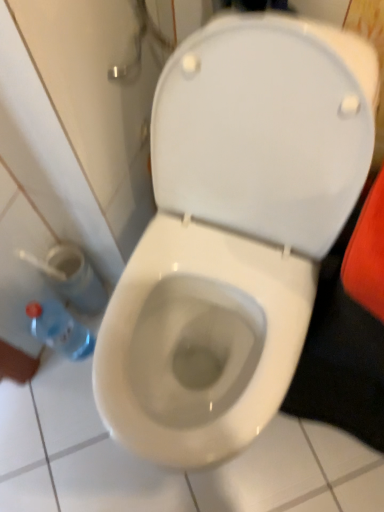
Question: From a real-world perspective, is blue plastic bottle at lower left located higher than white glossy toilet at center?

Choices:
 (A) no
 (B) yes

Answer: (A)

Question: Is blue plastic bottle at lower left oriented away from white glossy toilet at center?

Choices:
 (A) no
 (B) yes

Answer: (A)

Question: Can you confirm if blue plastic bottle at lower left is wider than white glossy toilet at center?

Choices:
 (A) no
 (B) yes

Answer: (A)

Question: Does blue plastic bottle at lower left appear on the right side of white glossy toilet at center?

Choices:
 (A) yes
 (B) no

Answer: (B)

Question: Is blue plastic bottle at lower left in front of white glossy toilet at center?

Choices:
 (A) no
 (B) yes

Answer: (A)

Question: Is blue plastic bottle at lower left outside of white glossy toilet at center?

Choices:
 (A) yes
 (B) no

Answer: (A)

Question: Is blue plastic bottle at lower left surrounded by white glossy toilet at center?

Choices:
 (A) no
 (B) yes

Answer: (A)

Question: From a real-world perspective, is white glossy toilet at center under blue plastic bottle at lower left?

Choices:
 (A) no
 (B) yes

Answer: (A)

Question: From a real-world perspective, does white glossy toilet at center stand above blue plastic bottle at lower left?

Choices:
 (A) no
 (B) yes

Answer: (B)

Question: Considering the relative positions of white glossy toilet at center and blue plastic bottle at lower left in the image provided, is white glossy toilet at center behind blue plastic bottle at lower left?

Choices:
 (A) yes
 (B) no

Answer: (B)

Question: Are white glossy toilet at center and blue plastic bottle at lower left making contact?

Choices:
 (A) yes
 (B) no

Answer: (B)

Question: Does white glossy toilet at center have a smaller size compared to blue plastic bottle at lower left?

Choices:
 (A) no
 (B) yes

Answer: (A)

Question: Which is correct: blue plastic bottle at lower left is inside white glossy toilet at center, or outside of it?

Choices:
 (A) inside
 (B) outside

Answer: (B)